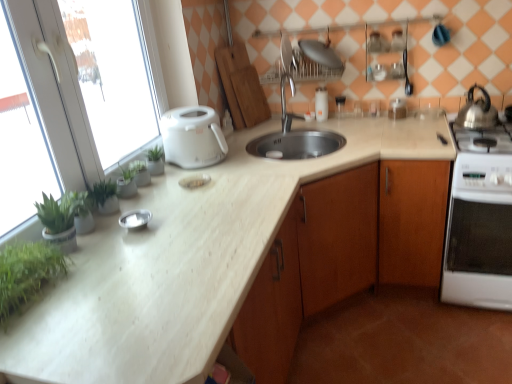
Image resolution: width=512 pixels, height=384 pixels. In order to click on vacant space in front of silver metallic faucet at center in this screenshot , I will do `click(293, 142)`.